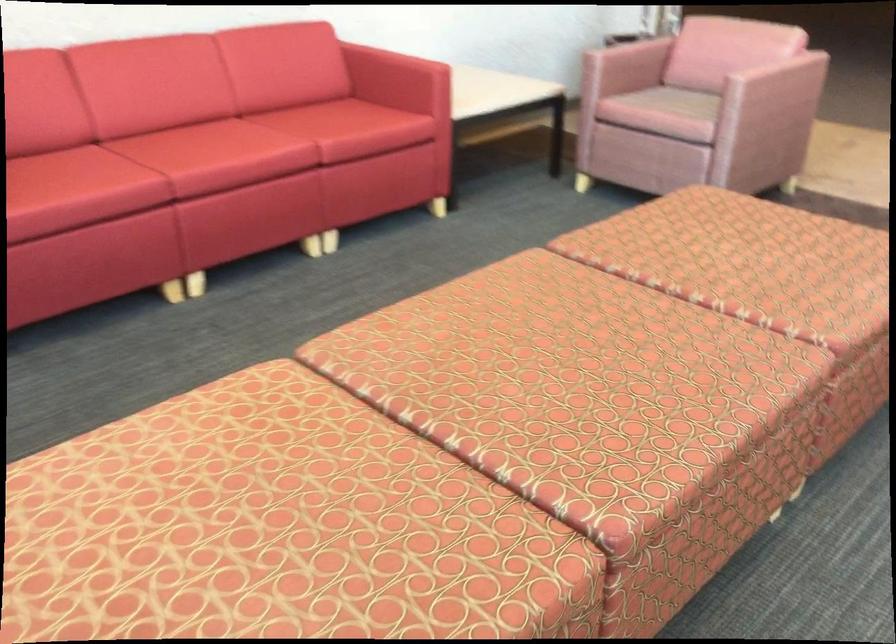
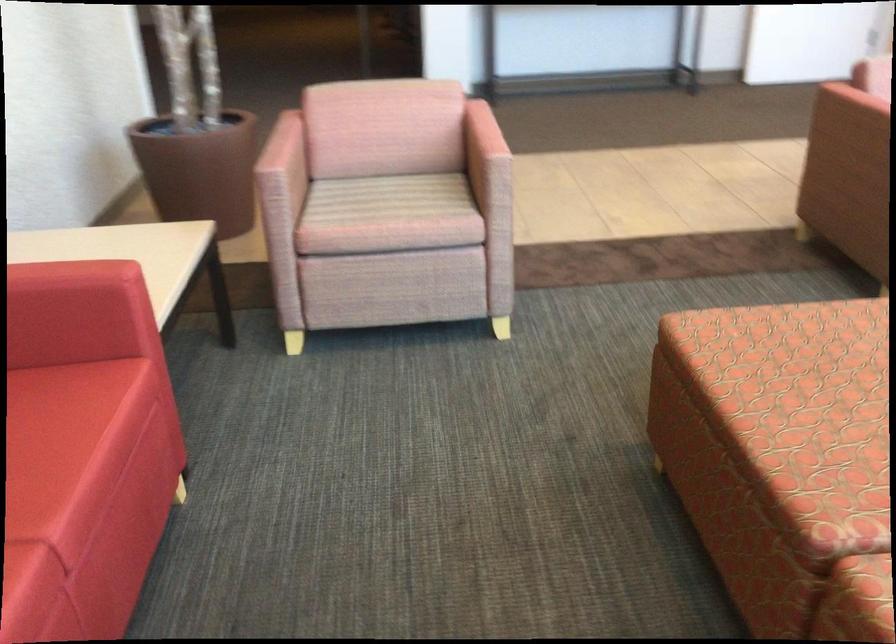
Locate, in the second image, the point that corresponds to (x=726, y=216) in the first image.

(782, 350)